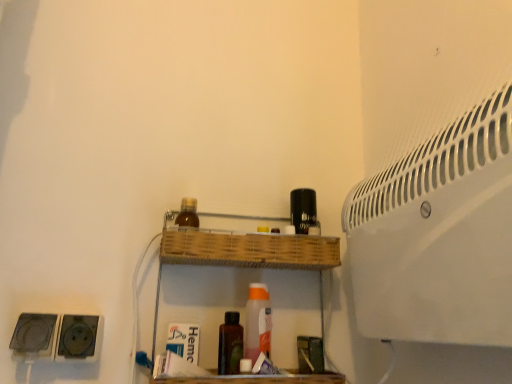
Question: Is black plastic speaker at lower left, which is the 2th speaker in right-to-left order, taller or shorter than brown glass bottle at upper center, arranged as the first bottle when viewed from the left?

Choices:
 (A) short
 (B) tall

Answer: (B)

Question: Considering the positions of point (53, 332) and point (190, 213), is point (53, 332) closer or farther from the camera than point (190, 213)?

Choices:
 (A) closer
 (B) farther

Answer: (A)

Question: Which object is the closest to the brown matte bottle at center, arranged as the 1th bottle when viewed from the right?

Choices:
 (A) black plastic speaker at lower left, acting as the first speaker starting from the left
 (B) wooden at center
 (C) brown glass bottle at upper center, the first bottle viewed from the top
 (D) white plastic air conditioning unit at upper right
 (E) black plastic socket at lower left, the first speaker when ordered from right to left

Answer: (B)

Question: Based on their relative distances, which object is nearer to the black plastic socket at lower left, marked as the 2th speaker in a left-to-right arrangement?

Choices:
 (A) white plastic air conditioning unit at upper right
 (B) brown glass bottle at upper center, the first bottle viewed from the top
 (C) brown matte bottle at center, which ranks as the 2th bottle in left-to-right order
 (D) black plastic speaker at lower left, acting as the first speaker starting from the left
 (E) wooden at center

Answer: (D)